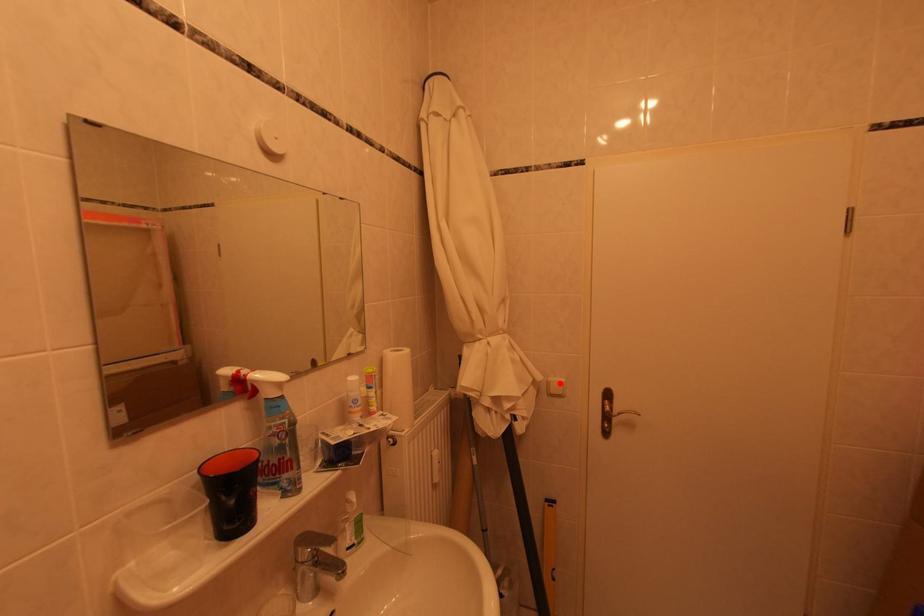
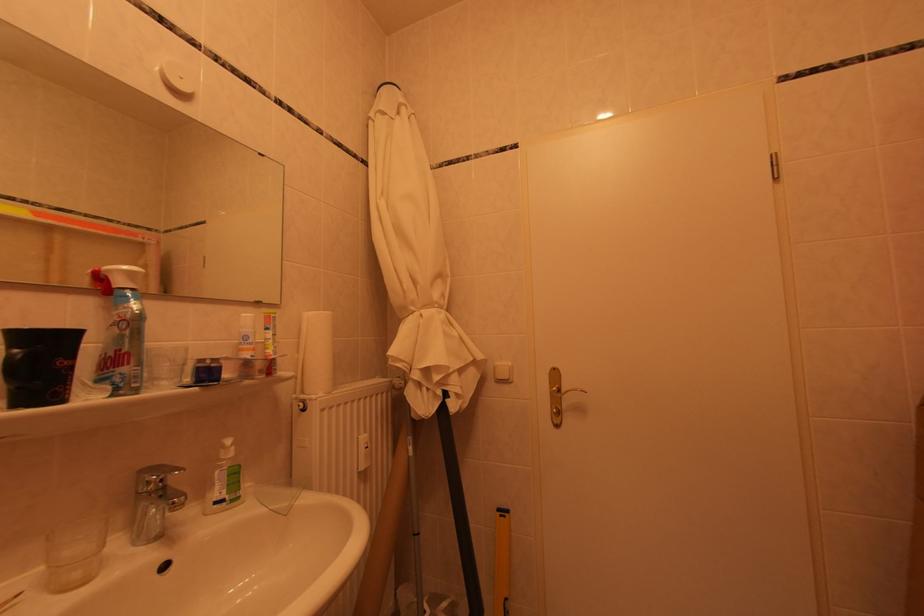
Locate, in the second image, the point that corresponds to the highlighted location in the first image.

(506, 367)